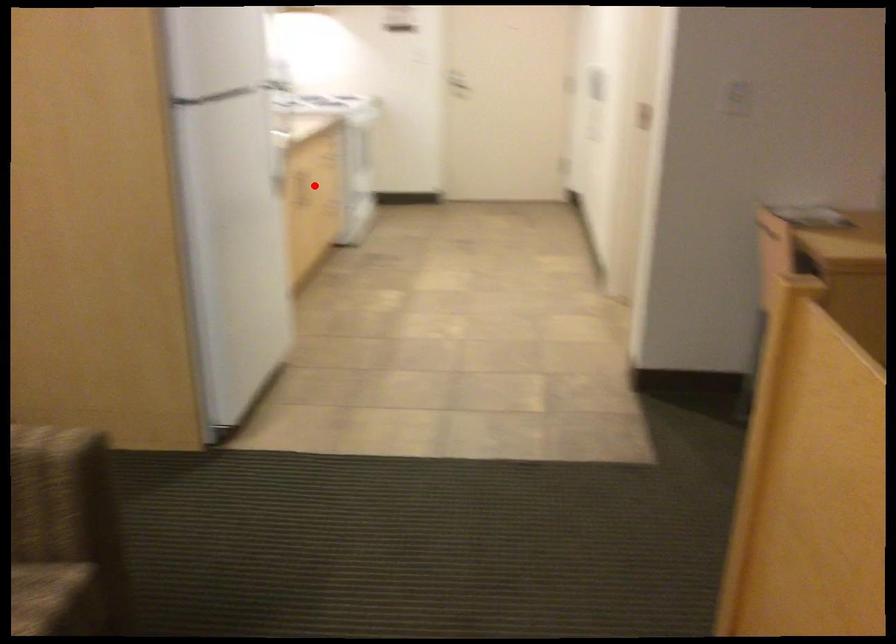
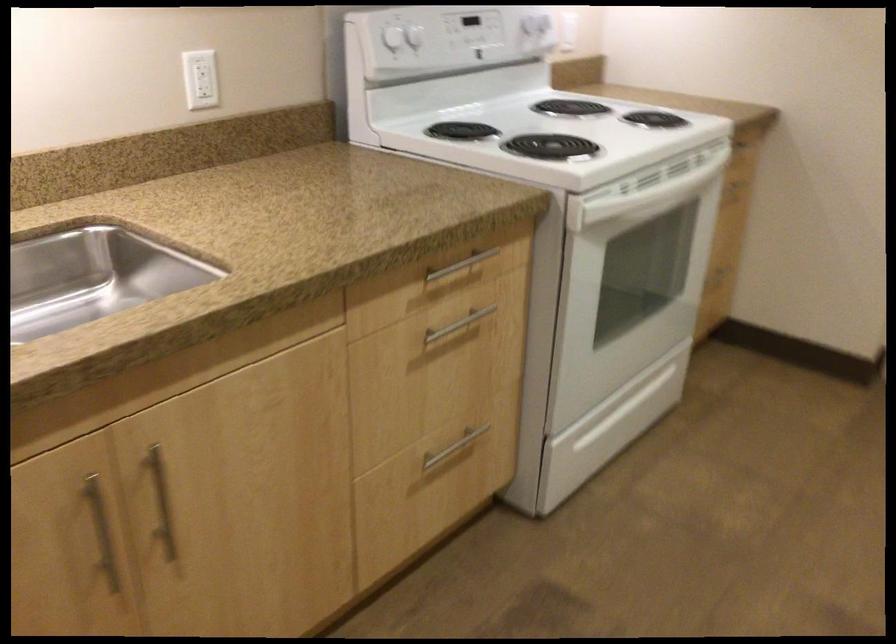
Question: I am providing you with two images of the same scene from different viewpoints. A red point is shown in image1. For the corresponding object point in image2, is it positioned nearer or farther from the camera?

Choices:
 (A) Nearer
 (B) Farther

Answer: (A)